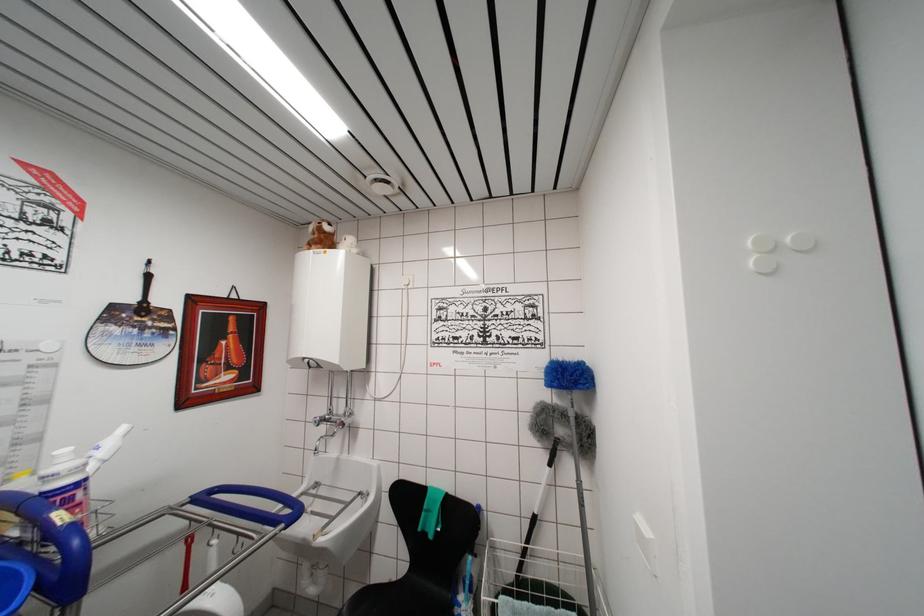
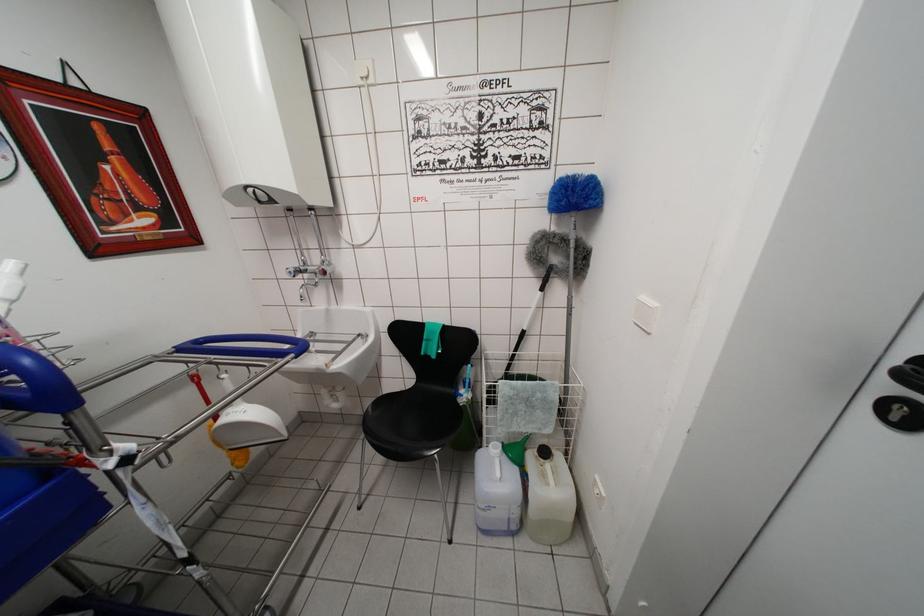
Find the pixel in the second image that matches (319,426) in the first image.

(293, 277)